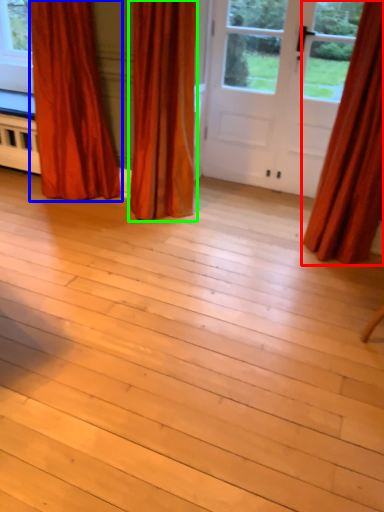
Question: Considering the real-world distances, which object is closest to curtain (highlighted by a red box)? curtain (highlighted by a blue box) or curtain (highlighted by a green box).

Choices:
 (A) curtain
 (B) curtain

Answer: (B)